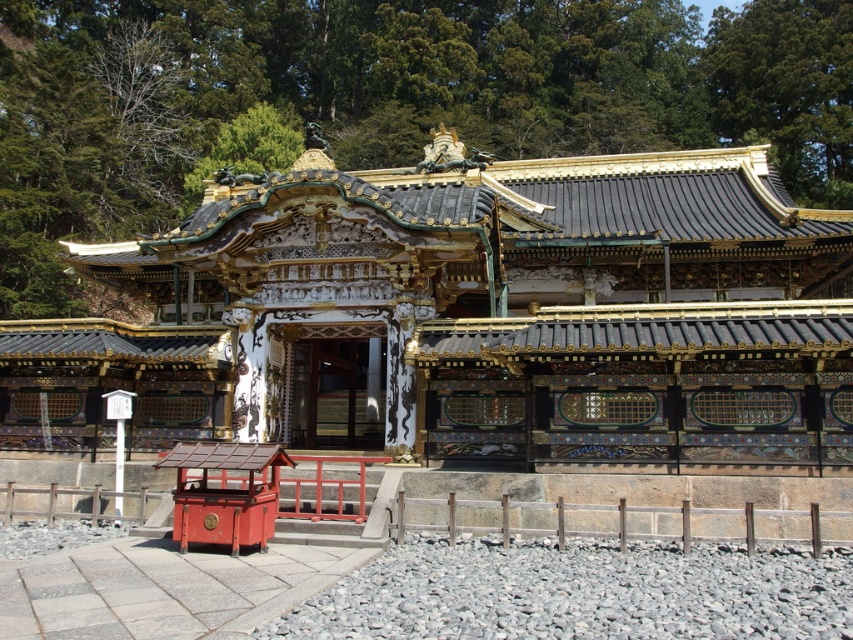
Can you confirm if polished wood shrine at center is positioned to the right of smooth red wooden box at lower left?

Indeed, polished wood shrine at center is positioned on the right side of smooth red wooden box at lower left.

Image resolution: width=853 pixels, height=640 pixels. What do you see at coordinates (471, 317) in the screenshot?
I see `polished wood shrine at center` at bounding box center [471, 317].

Is point (778, 403) more distant than point (267, 493)?

Yes, it is behind point (267, 493).

Find the location of a particular element. This screenshot has height=640, width=853. polished wood shrine at center is located at coordinates (471, 317).